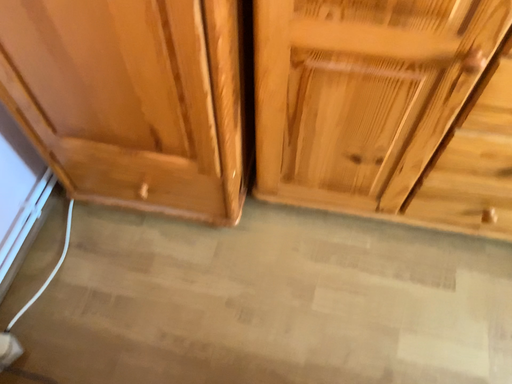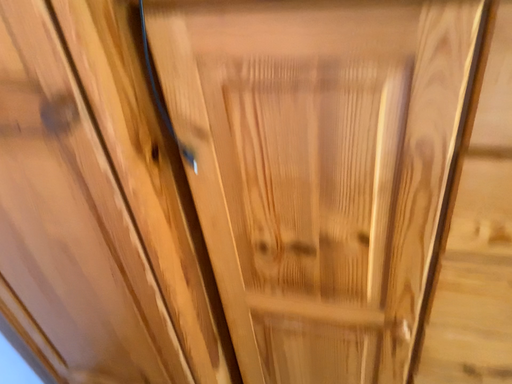
Question: How did the camera likely rotate when shooting the video?

Choices:
 (A) rotated upward
 (B) rotated downward

Answer: (A)